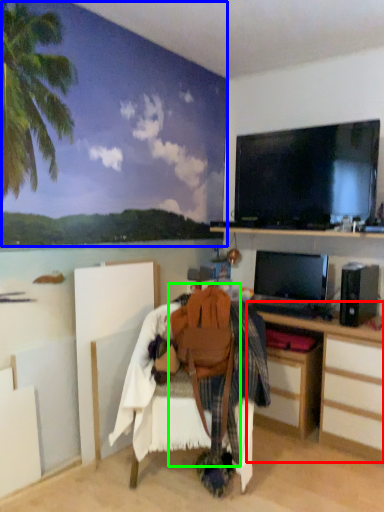
Question: Estimate the real-world distances between objects in this image. Which object is closer to desk (highlighted by a red box), backdrop (highlighted by a blue box) or swivel chair (highlighted by a green box)?

Choices:
 (A) backdrop
 (B) swivel chair

Answer: (B)